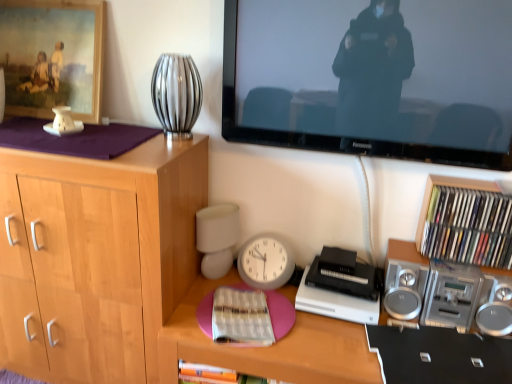
What are the coordinates of `free point above pink matte desk at center (from a real-world perspective)` in the screenshot? It's located at (312, 324).